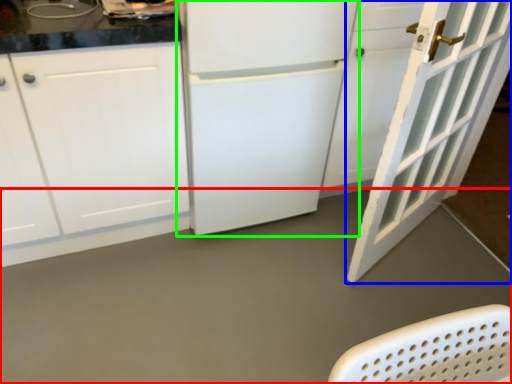
Question: Which is farther away from concrete (highlighted by a red box)? door (highlighted by a blue box) or refrigerator (highlighted by a green box)?

Choices:
 (A) door
 (B) refrigerator

Answer: (B)